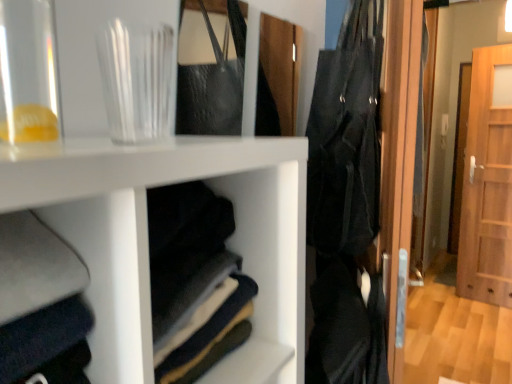
What is the approximate height of black fabric bag at right?

black fabric bag at right is 72.28 centimeters in height.

What is the approximate width of wooden door at right?

The width of wooden door at right is 5.59 inches.

Find the location of a particular element. transparent glass at upper left, which ranks as the first glass vase in back-to-front order is located at coordinates (136, 80).

Looking at this image, in the image, is wooden door at right positioned in front of or behind black fabric bag at right?

Visually, wooden door at right is located behind black fabric bag at right.

Is wooden door at right situated inside black fabric bag at right or outside?

wooden door at right exists outside the volume of black fabric bag at right.

At what (x,y) coordinates should I click in order to perform the action: click on clothing above the wooden door at right (from a real-world perspective). Please return your answer as a coordinate pair (x, y). This screenshot has width=512, height=384. Looking at the image, I should click on (346, 137).

Does black fabric bag at right have a smaller size compared to transparent glass jar at upper left, the 2th glass vase from the right?

No, black fabric bag at right is not smaller than transparent glass jar at upper left, the 2th glass vase from the right.

Relative to transparent glass jar at upper left, which ranks as the 2th glass vase in back-to-front order, is black fabric bag at right in front or behind?

In the image, black fabric bag at right appears behind transparent glass jar at upper left, which ranks as the 2th glass vase in back-to-front order.

Is black fabric bag at right in contact with transparent glass jar at upper left, which ranks as the 2th glass vase in back-to-front order?

They are not placed beside each other.

From a real-world perspective, which is physically above, transparent glass at upper left, arranged as the second glass vase when viewed from the left, or black fabric bag at right?

In real-world perspective, transparent glass at upper left, arranged as the second glass vase when viewed from the left, is above.

Considering their positions, is transparent glass at upper left, arranged as the second glass vase when viewed from the left, located in front of or behind black fabric bag at right?

Clearly, transparent glass at upper left, arranged as the second glass vase when viewed from the left, is in front of black fabric bag at right.

In the scene shown: Is transparent glass at upper left, arranged as the second glass vase when viewed from the left, placed right next to black fabric bag at right?

transparent glass at upper left, arranged as the second glass vase when viewed from the left, and black fabric bag at right are not in contact.

Starting from the black fabric bag at right, which glass vase is the 1st one to the left? Please provide its 2D coordinates.

[(136, 80)]

Can you tell me how much transparent glass jar at upper left, the first glass vase in the left-to-right sequence, and black fabric bag at right differ in facing direction?

21.2 degrees separate the facing orientations of transparent glass jar at upper left, the first glass vase in the left-to-right sequence, and black fabric bag at right.

Which is behind, transparent glass jar at upper left, placed as the first glass vase when sorted from front to back, or black fabric bag at right?

black fabric bag at right is further from the camera.

Would you say transparent glass jar at upper left, the 2th glass vase from the right, is to the left or to the right of black fabric bag at right in the picture?

From the image, it's evident that transparent glass jar at upper left, the 2th glass vase from the right, is to the left of black fabric bag at right.

Considering the sizes of objects transparent glass jar at upper left, which ranks as the 2th glass vase in back-to-front order, and black fabric bag at right in the image provided, who is thinner, transparent glass jar at upper left, which ranks as the 2th glass vase in back-to-front order, or black fabric bag at right?

With smaller width is transparent glass jar at upper left, which ranks as the 2th glass vase in back-to-front order.

Is transparent glass at upper left, which appears as the second glass vase when viewed from the front, wider than transparent glass jar at upper left, which ranks as the 2th glass vase in back-to-front order?

Indeed, transparent glass at upper left, which appears as the second glass vase when viewed from the front, has a greater width compared to transparent glass jar at upper left, which ranks as the 2th glass vase in back-to-front order.

Based on the photo, from a real-world perspective, does transparent glass at upper left, arranged as the second glass vase when viewed from the left, stand above transparent glass jar at upper left, the first glass vase in the left-to-right sequence?

Actually, transparent glass at upper left, arranged as the second glass vase when viewed from the left, is physically below transparent glass jar at upper left, the first glass vase in the left-to-right sequence, in the real world.

Is transparent glass at upper left, arranged as the second glass vase when viewed from the left, smaller than transparent glass jar at upper left, the first glass vase in the left-to-right sequence?

Yes.

Which object is closer to the camera, transparent glass at upper left, marked as the first glass vase in a right-to-left arrangement, or transparent glass jar at upper left, which ranks as the 2th glass vase in back-to-front order?

Positioned in front is transparent glass jar at upper left, which ranks as the 2th glass vase in back-to-front order.

Is black fabric bag at right beside transparent glass at upper left, which appears as the second glass vase when viewed from the front?

No.

Can you confirm if black fabric bag at right is taller than transparent glass at upper left, which appears as the second glass vase when viewed from the front?

Indeed, black fabric bag at right has a greater height compared to transparent glass at upper left, which appears as the second glass vase when viewed from the front.

Which is less distant, (x=359, y=32) or (x=143, y=124)?

Point (x=359, y=32) is positioned farther from the camera compared to point (x=143, y=124).

From the image's perspective, starting from the black fabric bag at right, which glass vase is the 2nd one below? Please provide its 2D coordinates.

[(136, 80)]

Considering the positions of point (307, 186) and point (471, 245), is point (307, 186) closer or farther from the camera than point (471, 245)?

Point (307, 186) is closer to the camera than point (471, 245).

Relative to wooden door at right, is black fabric bag at right in front or behind?

black fabric bag at right is in front of wooden door at right.

Is black fabric bag at right inside the boundaries of wooden door at right, or outside?

black fabric bag at right lies outside wooden door at right.

Consider the image. Which is more to the left, black fabric bag at right or wooden door at right?

black fabric bag at right is more to the left.

In the image, there is a wooden door at right. Where is `clothing above it (from the image's perspective)`? This screenshot has height=384, width=512. clothing above it (from the image's perspective) is located at coordinates (346, 137).

From the image's perspective, count 1st glass vases downward from the black fabric bag at right and point to it. Please provide its 2D coordinates.

[(28, 73)]

Considering their positions, is transparent glass jar at upper left, the 2th glass vase from the right, positioned closer to transparent glass at upper left, which ranks as the first glass vase in back-to-front order, than wooden door at right?

Based on the image, transparent glass jar at upper left, the 2th glass vase from the right, appears to be nearer to transparent glass at upper left, which ranks as the first glass vase in back-to-front order.

Looking at the image, which one is located further to transparent glass jar at upper left, the first glass vase in the left-to-right sequence, wooden door at right or transparent glass at upper left, which ranks as the first glass vase in back-to-front order?

Based on the image, wooden door at right appears to be further to transparent glass jar at upper left, the first glass vase in the left-to-right sequence.

Considering their positions, is transparent glass at upper left, which ranks as the first glass vase in back-to-front order, positioned further to transparent glass jar at upper left, placed as the first glass vase when sorted from front to back, than black fabric bag at right?

black fabric bag at right lies further to transparent glass jar at upper left, placed as the first glass vase when sorted from front to back, than the other object.

Considering their positions, is wooden door at right positioned further to transparent glass jar at upper left, the first glass vase in the left-to-right sequence, than black fabric bag at right?

Among the two, wooden door at right is located further to transparent glass jar at upper left, the first glass vase in the left-to-right sequence.

From the image, which object appears to be farther from wooden door at right, transparent glass jar at upper left, the first glass vase in the left-to-right sequence, or transparent glass at upper left, marked as the first glass vase in a right-to-left arrangement?

transparent glass jar at upper left, the first glass vase in the left-to-right sequence, is positioned further to the anchor wooden door at right.

From the image, which object appears to be nearer to black fabric bag at right, transparent glass jar at upper left, placed as the first glass vase when sorted from front to back, or wooden door at right?

transparent glass jar at upper left, placed as the first glass vase when sorted from front to back, is positioned closer to the anchor black fabric bag at right.

Estimate the real-world distances between objects in this image. Which object is further from transparent glass jar at upper left, the 2th glass vase from the right, black fabric bag at right or wooden door at right?

Among the two, wooden door at right is located further to transparent glass jar at upper left, the 2th glass vase from the right.

Considering their positions, is wooden door at right positioned further to black fabric bag at right than transparent glass jar at upper left, the 2th glass vase from the right?

wooden door at right lies further to black fabric bag at right than the other object.

You are a GUI agent. You are given a task and a screenshot of the screen. Output one action in this format:
    pyautogui.click(x=<x>, y=<y>)
    Task: Click on the clothing located between transparent glass at upper left, arranged as the second glass vase when viewed from the left, and wooden door at right in the depth direction
    
    Given the screenshot: What is the action you would take?
    pyautogui.click(x=346, y=137)

This screenshot has width=512, height=384. I want to click on glass vase between transparent glass jar at upper left, the first glass vase in the left-to-right sequence, and black fabric bag at right, along the z-axis, so click(x=136, y=80).

Locate an element on the screen. The image size is (512, 384). glass vase located between transparent glass jar at upper left, the first glass vase in the left-to-right sequence, and wooden door at right in the depth direction is located at coordinates (136, 80).

Locate an element on the screen. Image resolution: width=512 pixels, height=384 pixels. clothing located between transparent glass jar at upper left, the first glass vase in the left-to-right sequence, and wooden door at right in the depth direction is located at coordinates (346, 137).